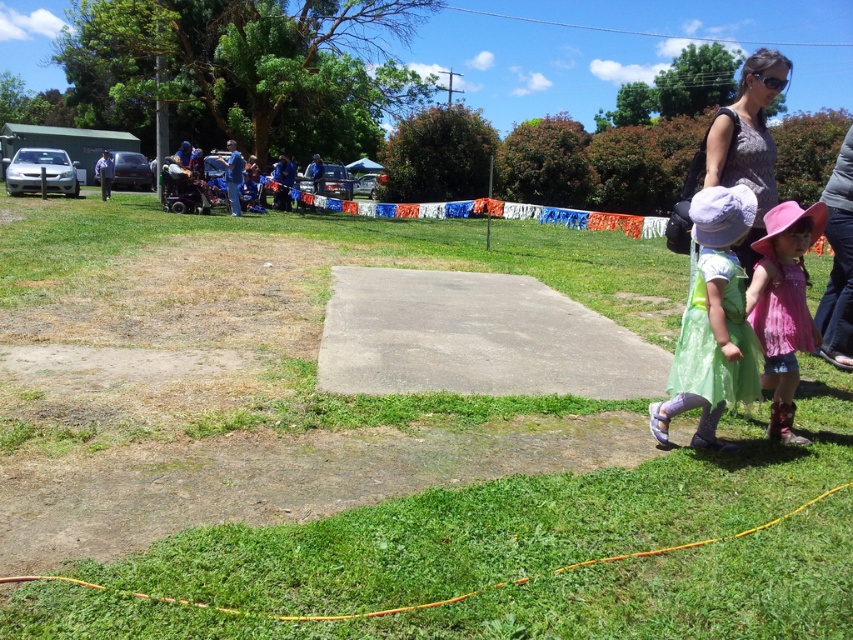
You are at the community event and want to take a photo of the pastel green dress at right and the matte gray shirt at upper right. Which of the two objects takes up more space in the photo?

The matte gray shirt at upper right takes up more space in the photo because the pastel green dress at right occupies less space than matte gray shirt at upper right.

You are organizing a fashion show and need to arrange two pink fabric dresses. The pink fabric dress at lower right and the pink fabric dress at right are both on the runway. Which dress should be placed first if you want the smaller one to be seen by the audience first?

The pink fabric dress at lower right should be placed first because it has a smaller size compared to the pink fabric dress at right, ensuring the smaller one is seen first by the audience.